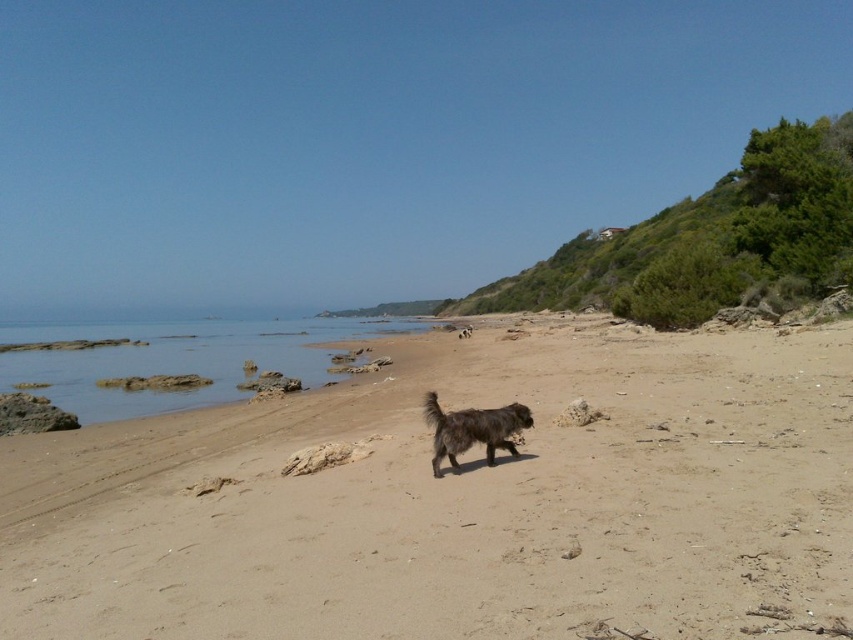
Question: Can you confirm if brown sandy beach at center is bigger than fuzzy brown dog at center?

Choices:
 (A) no
 (B) yes

Answer: (B)

Question: Is brown sandy beach at center positioned behind fuzzy brown dog at center?

Choices:
 (A) yes
 (B) no

Answer: (B)

Question: Can you confirm if clear water at lower left is positioned below fuzzy brown dog at center?

Choices:
 (A) yes
 (B) no

Answer: (B)

Question: Which object is closer to the camera taking this photo?

Choices:
 (A) fuzzy brown dog at center
 (B) brown sandy beach at center
 (C) clear water at lower left

Answer: (B)

Question: Which object is farther from the camera taking this photo?

Choices:
 (A) fuzzy brown dog at center
 (B) clear water at lower left
 (C) brown sandy beach at center

Answer: (B)

Question: Among these points, which one is farthest from the camera?

Choices:
 (A) (434, 448)
 (B) (292, 586)

Answer: (A)